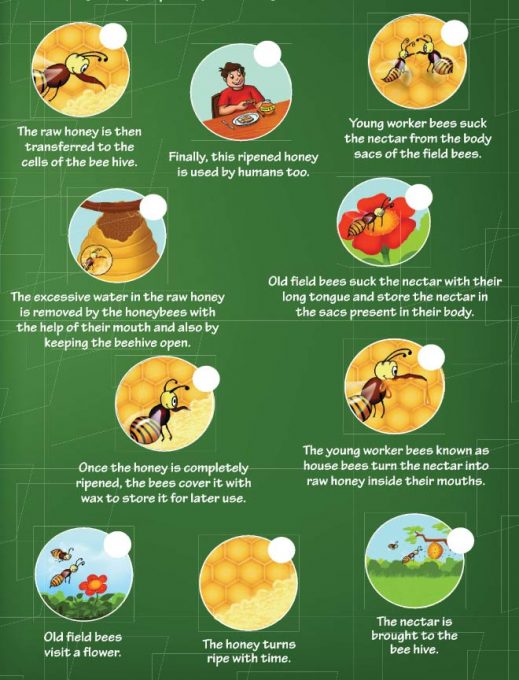
Identify the location of bread on a plate. This screenshot has height=680, width=519. (245, 119).